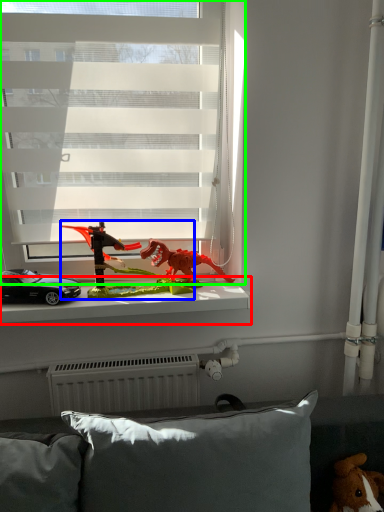
Question: Which is nearer to the window sill (highlighted by a red box)? toy (highlighted by a blue box) or window (highlighted by a green box).

Choices:
 (A) toy
 (B) window

Answer: (A)